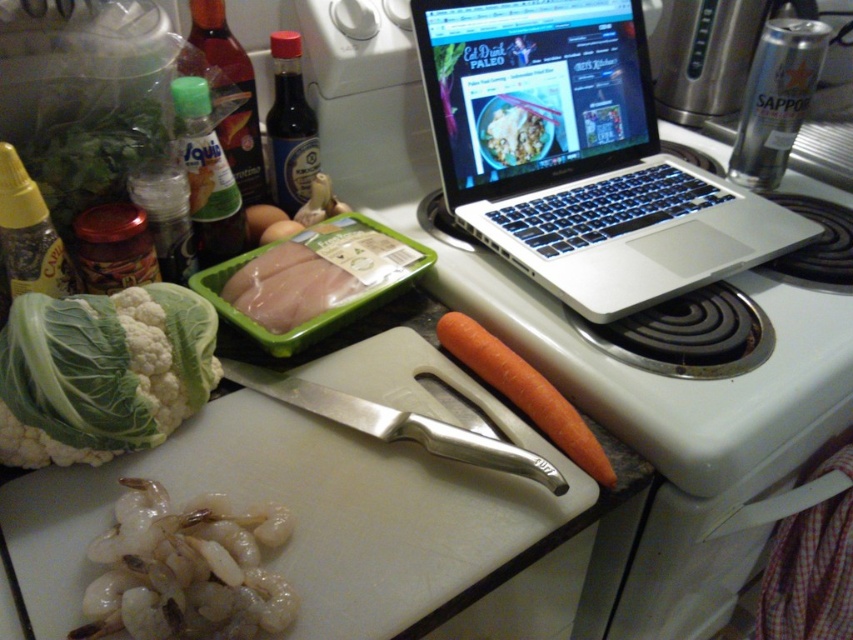
Question: Does white ceramic stove at upper right appear on the right side of silver metallic knife at center?

Choices:
 (A) yes
 (B) no

Answer: (A)

Question: Based on their relative distances, which object is nearer to the white plastic cutting board at center?

Choices:
 (A) orange smooth carrot at center
 (B) green leafy cabbage at left

Answer: (B)

Question: Does orange smooth carrot at center have a greater width compared to smooth white rice bowl at center?

Choices:
 (A) no
 (B) yes

Answer: (B)

Question: Which of the following is the farthest from the observer?

Choices:
 (A) (102, 406)
 (B) (589, 269)
 (C) (560, 445)

Answer: (B)

Question: Does silver/black laptop at upper center have a larger size compared to green leafy cabbage at left?

Choices:
 (A) no
 (B) yes

Answer: (B)

Question: Which of the following is the closest to the observer?

Choices:
 (A) (811, 358)
 (B) (16, 566)
 (C) (521, 120)
 (D) (51, 353)

Answer: (B)